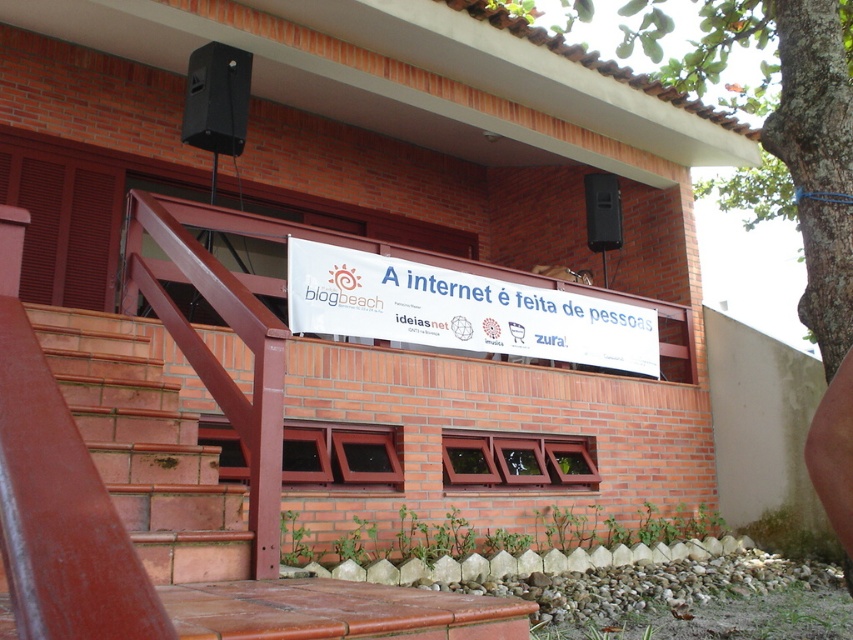
You are a delivery person trying to place a small package on the building entrance. The package is 30 cm wide. The white paper banner at upper center and the black matte speaker at upper center are both located at the entrance. Can you fit the package between them?

The white paper banner at upper center might be wider than black matte speaker at upper center, so the space between them may be sufficient to fit the 30 cm wide package. However, since the exact width difference isn

You are a delivery person trying to place a small package on the terracotta brick stairs at lower left. Can the black plastic speaker at upper center fit on the same stair step as the package?

The terracotta brick stairs at lower left has a larger size compared to black plastic speaker at upper center, so yes, the black plastic speaker at upper center can fit on the same stair step as the package.

You are a delivery person trying to place a black matte speaker at upper center and a black plastic speaker at upper center on the brick building facade. The building has a balcony with a white banner at upper center. Can you fit both speakers on the balcony without overlapping them?

The black matte speaker at upper center is much taller than the black plastic speaker at upper center. Since the balcony has limited space, it might be challenging to fit both speakers without overlapping, especially considering the height difference between them. However, if the total width required for both speakers is within the balcony dimensions, they could potentially be placed side by side. The exact feasibility depends on the balcony size and speaker widths, which are not specified here.